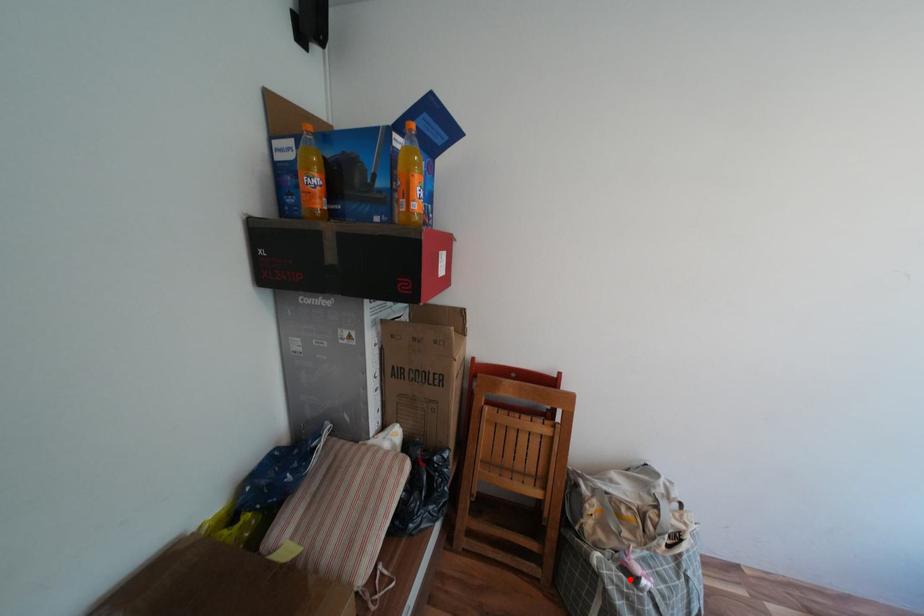
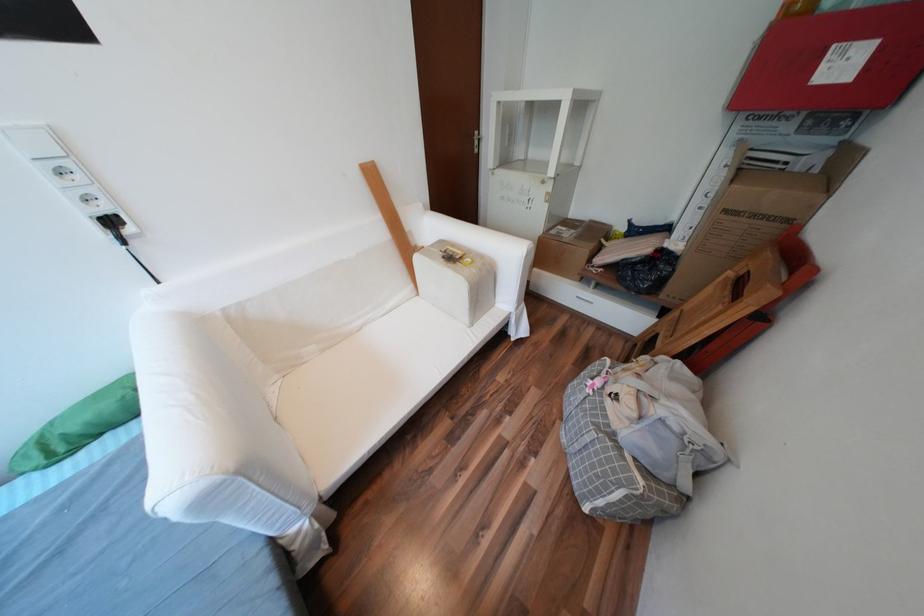
Find the pixel in the second image that matches the highlighted location in the first image.

(602, 371)